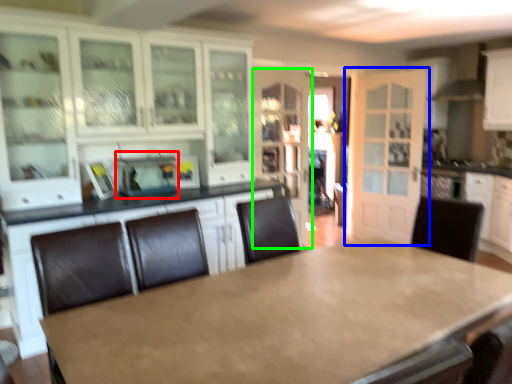
Question: Based on their relative distances, which object is farther from appliance (highlighted by a red box)? Choose from door (highlighted by a blue box) and cabinetry (highlighted by a green box).

Choices:
 (A) door
 (B) cabinetry

Answer: (A)